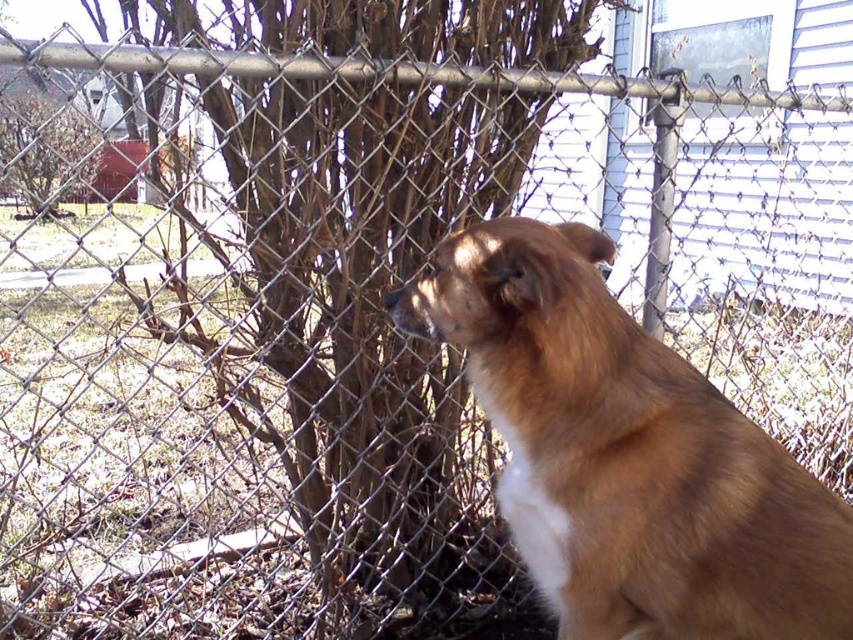
Question: Is brown fluffy dog at center below bare branches at upper left?

Choices:
 (A) yes
 (B) no

Answer: (A)

Question: Where is brown fluffy dog at center located in relation to bare branches at upper left in the image?

Choices:
 (A) left
 (B) right

Answer: (B)

Question: Which point appears closest to the camera in this image?

Choices:
 (A) (575, 310)
 (B) (74, 120)

Answer: (A)

Question: Does brown fluffy dog at center appear over bare branches at upper left?

Choices:
 (A) yes
 (B) no

Answer: (B)